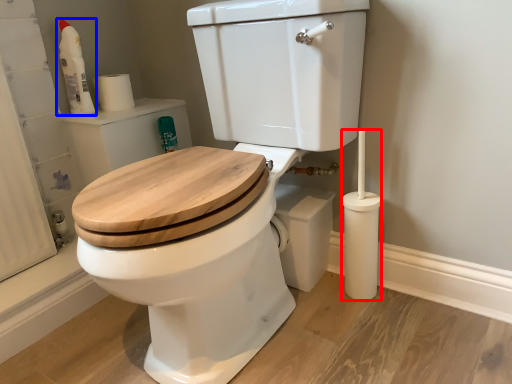
Question: Which object is further to the camera taking this photo, brush (highlighted by a red box) or cleaning product (highlighted by a blue box)?

Choices:
 (A) brush
 (B) cleaning product

Answer: (B)